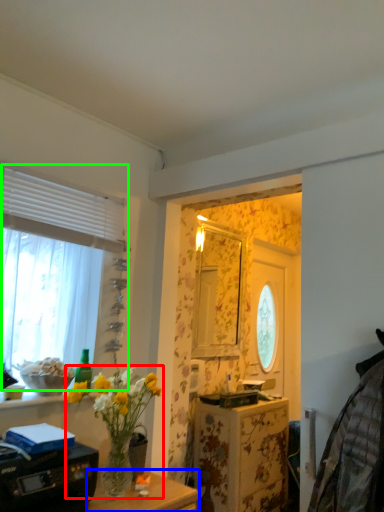
Question: Considering the real-world distances, which object is farthest from houseplant (highlighted by a red box)? table (highlighted by a blue box) or window (highlighted by a green box)?

Choices:
 (A) table
 (B) window

Answer: (B)